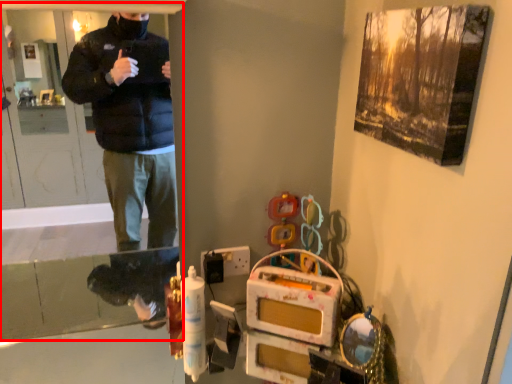
Question: From the image's perspective, what is the correct spatial positioning of screen door (annotated by the red box) in reference to switch?

Choices:
 (A) below
 (B) above

Answer: (B)